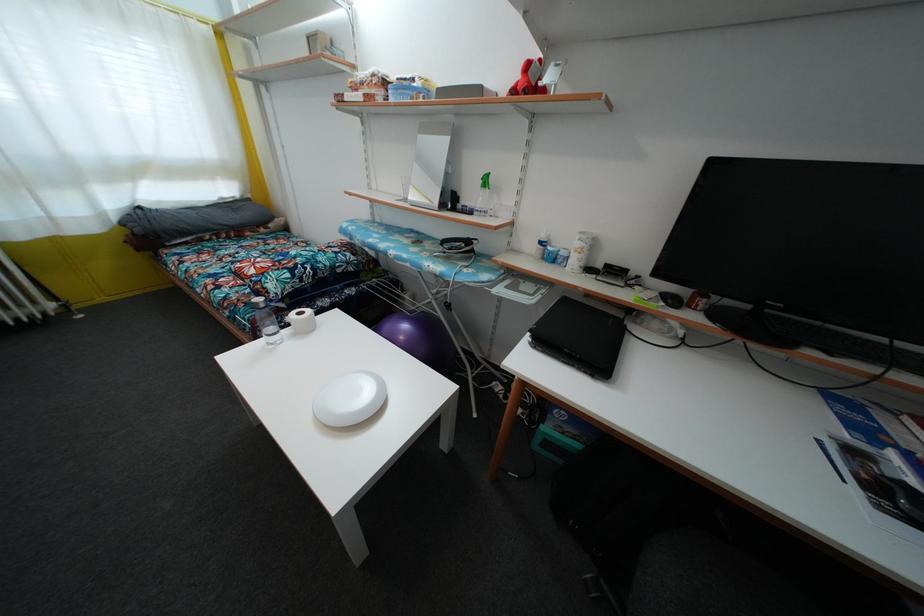
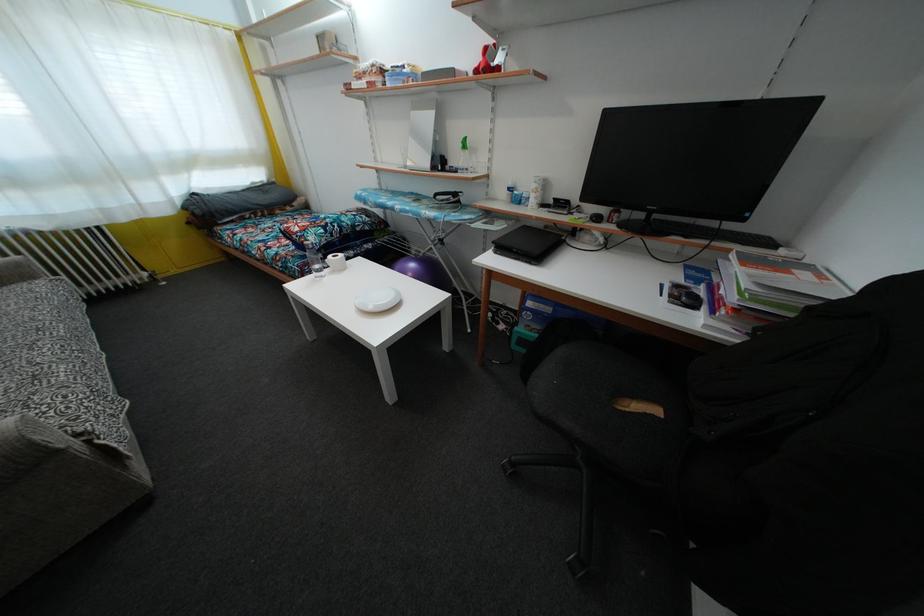
Locate, in the second image, the point that corresponds to point (408, 333) in the first image.

(416, 272)